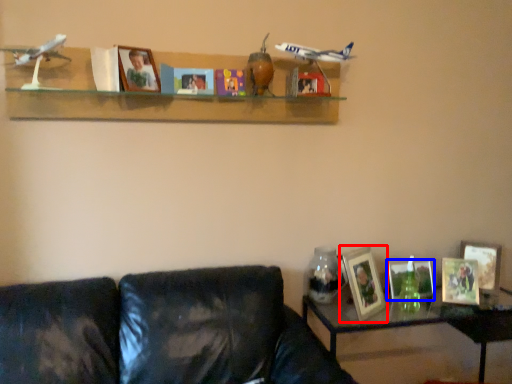
Question: Among these objects, which one is farthest to the camera, picture frame (highlighted by a red box) or picture frame (highlighted by a blue box)?

Choices:
 (A) picture frame
 (B) picture frame

Answer: (B)